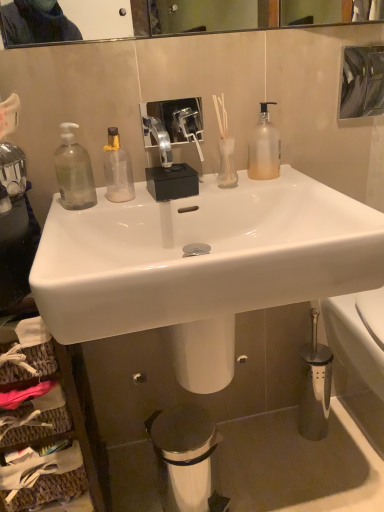
Question: Considering the relative sizes of frosted glass pump bottle at upper right, which is counted as the 3th bottle, starting from the left, and white glossy sink at center in the image provided, is frosted glass pump bottle at upper right, which is counted as the 3th bottle, starting from the left, wider than white glossy sink at center?

Choices:
 (A) yes
 (B) no

Answer: (B)

Question: From a real-world perspective, is frosted glass pump bottle at upper right, the first bottle positioned from the right, beneath white glossy sink at center?

Choices:
 (A) no
 (B) yes

Answer: (A)

Question: From the image's perspective, is frosted glass pump bottle at upper right, the first bottle positioned from the right, located above white glossy sink at center?

Choices:
 (A) yes
 (B) no

Answer: (A)

Question: Considering the relative positions of frosted glass pump bottle at upper right, the first bottle positioned from the right, and white glossy sink at center in the image provided, is frosted glass pump bottle at upper right, the first bottle positioned from the right, to the left of white glossy sink at center from the viewer's perspective?

Choices:
 (A) no
 (B) yes

Answer: (A)

Question: From the image's perspective, is frosted glass pump bottle at upper right, the first bottle positioned from the right, under white glossy sink at center?

Choices:
 (A) no
 (B) yes

Answer: (A)

Question: From the image's perspective, is white glossy sink at center above or below transparent plastic bottle at left, which is the 3th bottle in right-to-left order?

Choices:
 (A) below
 (B) above

Answer: (A)

Question: In terms of height, does white glossy sink at center look taller or shorter compared to transparent plastic bottle at left, which ranks as the first bottle in left-to-right order?

Choices:
 (A) tall
 (B) short

Answer: (A)

Question: Does point (261, 211) appear closer or farther from the camera than point (74, 138)?

Choices:
 (A) farther
 (B) closer

Answer: (A)

Question: From a real-world perspective, is white glossy sink at center positioned above or below transparent plastic bottle at left, which is the 3th bottle in right-to-left order?

Choices:
 (A) below
 (B) above

Answer: (A)

Question: Considering the positions of point (359, 100) and point (87, 206), is point (359, 100) closer or farther from the camera than point (87, 206)?

Choices:
 (A) farther
 (B) closer

Answer: (A)

Question: In terms of width, does metallic reflective mirror at upper right look wider or thinner when compared to transparent plastic bottle at left, which ranks as the first bottle in left-to-right order?

Choices:
 (A) thin
 (B) wide

Answer: (A)

Question: Is metallic reflective mirror at upper right situated inside transparent plastic bottle at left, which ranks as the first bottle in left-to-right order, or outside?

Choices:
 (A) inside
 (B) outside

Answer: (B)

Question: Based on their positions, is metallic reflective mirror at upper right located to the left or right of transparent plastic bottle at left, which is the 3th bottle in right-to-left order?

Choices:
 (A) right
 (B) left

Answer: (A)

Question: Is clear glass bottle at center, the second bottle positioned from the left, situated inside translucent glass vase at center or outside?

Choices:
 (A) inside
 (B) outside

Answer: (B)

Question: Is clear glass bottle at center, which is the 2th bottle from right to left, taller or shorter than translucent glass vase at center?

Choices:
 (A) tall
 (B) short

Answer: (A)